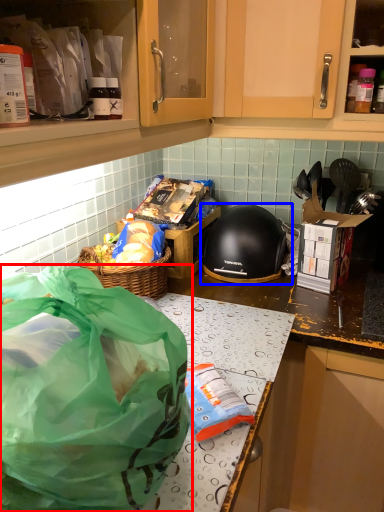
Question: Which object is further to the camera taking this photo, plastic bag (highlighted by a red box) or helmet (highlighted by a blue box)?

Choices:
 (A) plastic bag
 (B) helmet

Answer: (B)